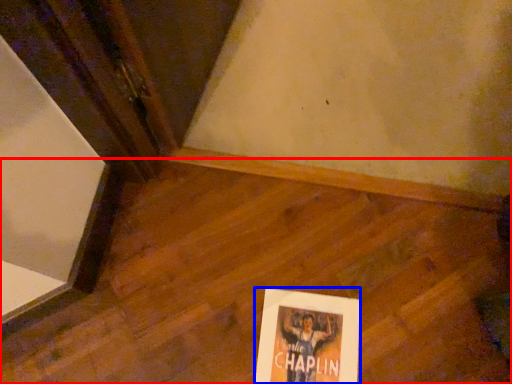
Question: Which of the following is the closest to the observer, plywood (highlighted by a red box) or poster (highlighted by a blue box)?

Choices:
 (A) plywood
 (B) poster

Answer: (A)